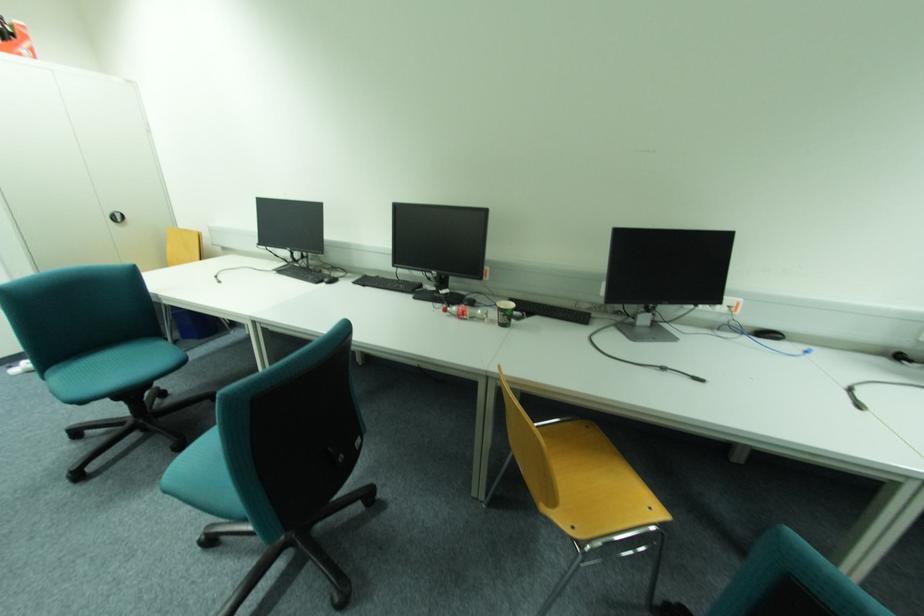
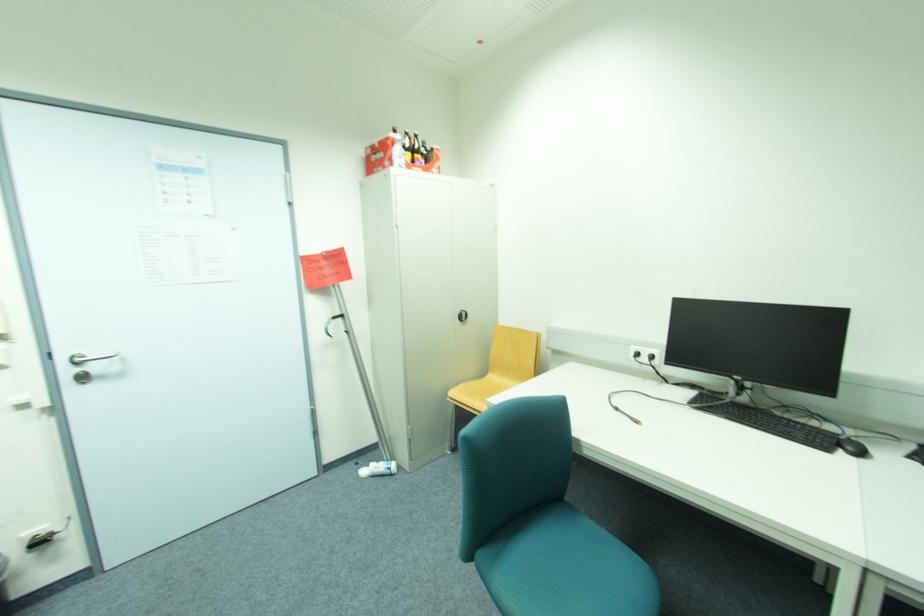
Where in the second image is the point corresponding to point 330,284 from the first image?

(847, 454)